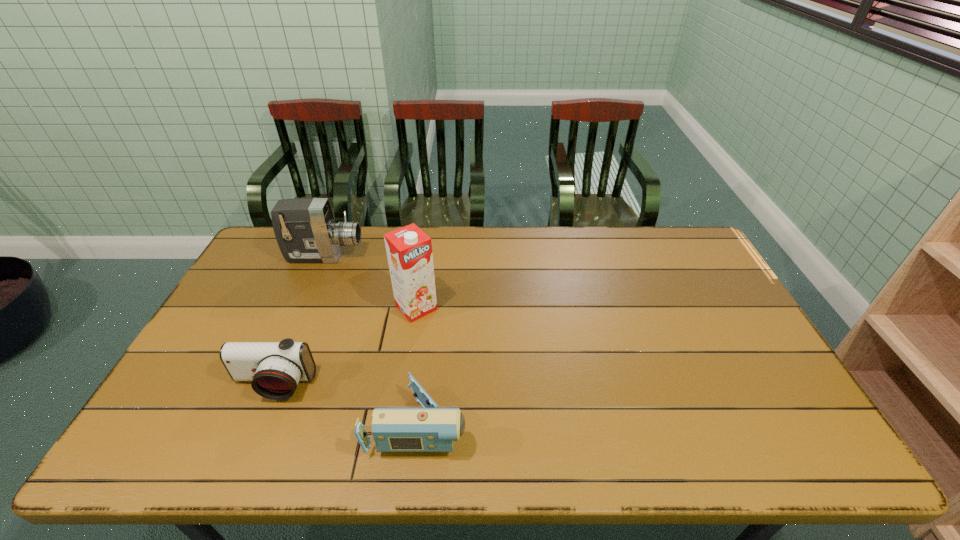
Find the location of a particular element. This screenshot has height=540, width=960. the tallest object is located at coordinates (409, 250).

Where is `the third nearest object`? This screenshot has height=540, width=960. the third nearest object is located at coordinates (409, 250).

Where is `the tallest camcorder`? The height and width of the screenshot is (540, 960). the tallest camcorder is located at coordinates (305, 229).

Identify the location of the farthest object. (305, 229).

Locate an element on the screen. This screenshot has height=540, width=960. the rightmost camcorder is located at coordinates (429, 429).

Identify the location of free point located on the left of the third nearest object. (353, 307).

Identify the location of free location located 0.350m at the front of the farthest object, highlighting the lens. The height and width of the screenshot is (540, 960). (462, 256).

Image resolution: width=960 pixels, height=540 pixels. What are the coordinates of `free space located on the side of the rightmost camcorder with the flip-out screen` in the screenshot? It's located at (562, 423).

You are a GUI agent. You are given a task and a screenshot of the screen. Output one action in this format:
    pyautogui.click(x=<x>, y=<y>)
    Task: Click on the object situated at the far edge
    The width and height of the screenshot is (960, 540).
    Given the screenshot: What is the action you would take?
    305,229

I want to click on object located at the near edge, so click(429, 429).